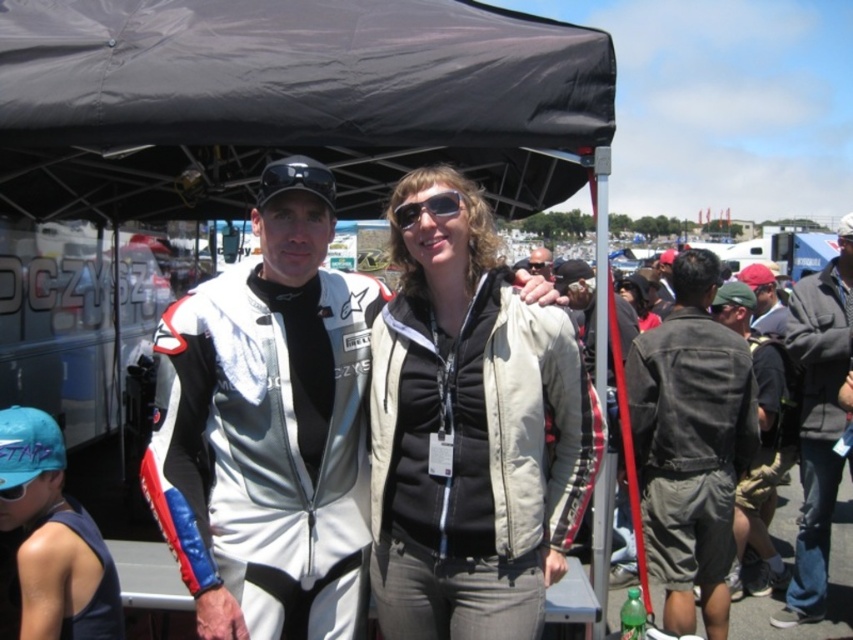
Question: Is black fabric canopy at upper center to the left of beige fabric jacket at center from the viewer's perspective?

Choices:
 (A) no
 (B) yes

Answer: (B)

Question: Which of the following is the closest to the observer?

Choices:
 (A) (556, 118)
 (B) (660, 525)
 (C) (317, 161)
 (D) (39, 440)

Answer: (D)

Question: Among these points, which one is nearest to the camera?

Choices:
 (A) (642, 401)
 (B) (434, 216)
 (C) (548, 337)
 (D) (466, 61)

Answer: (B)

Question: Which point is farther to the camera?

Choices:
 (A) (82, 157)
 (B) (404, 227)
 (C) (642, 355)

Answer: (A)

Question: Is denim jacket at center in front of blue fabric cap at lower left?

Choices:
 (A) yes
 (B) no

Answer: (B)

Question: Can you confirm if white leather jacket at center is smaller than beige fabric jacket at center?

Choices:
 (A) yes
 (B) no

Answer: (B)